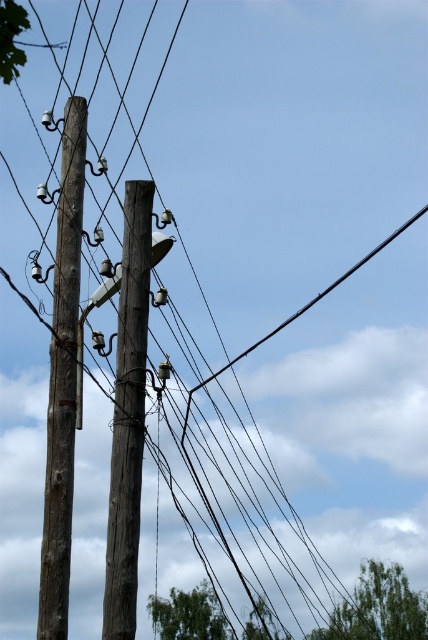
Question: Where is wooden telegraph pole at left located in relation to brown wooden telegraph pole at center in the image?

Choices:
 (A) right
 (B) left

Answer: (B)

Question: Where is wooden telegraph pole at left located in relation to brown wooden telegraph pole at center in the image?

Choices:
 (A) left
 (B) right

Answer: (A)

Question: Which of the following is the farthest from the observer?

Choices:
 (A) brown wooden telegraph pole at center
 (B) wooden telegraph pole at left

Answer: (B)

Question: Is wooden telegraph pole at left to the left of brown wooden telegraph pole at center from the viewer's perspective?

Choices:
 (A) no
 (B) yes

Answer: (B)